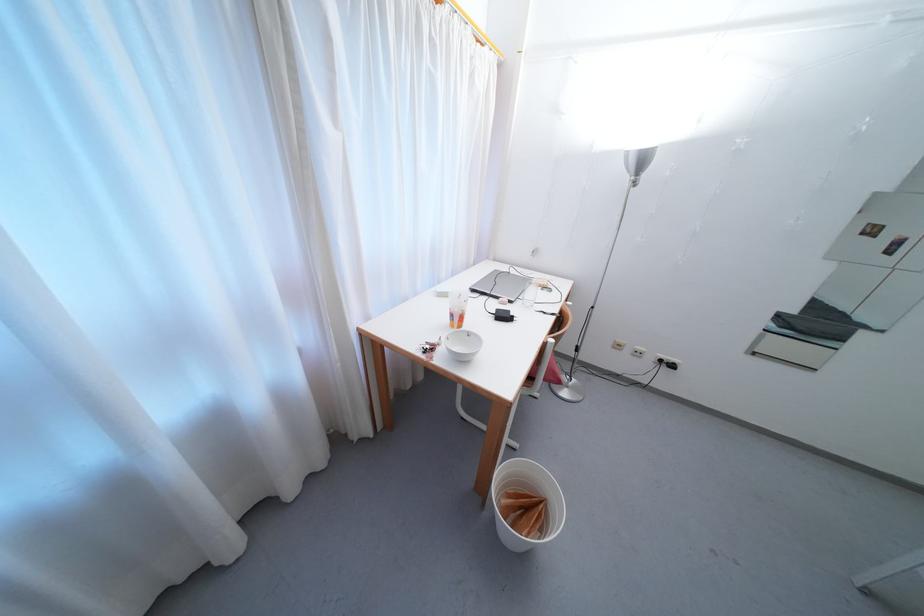
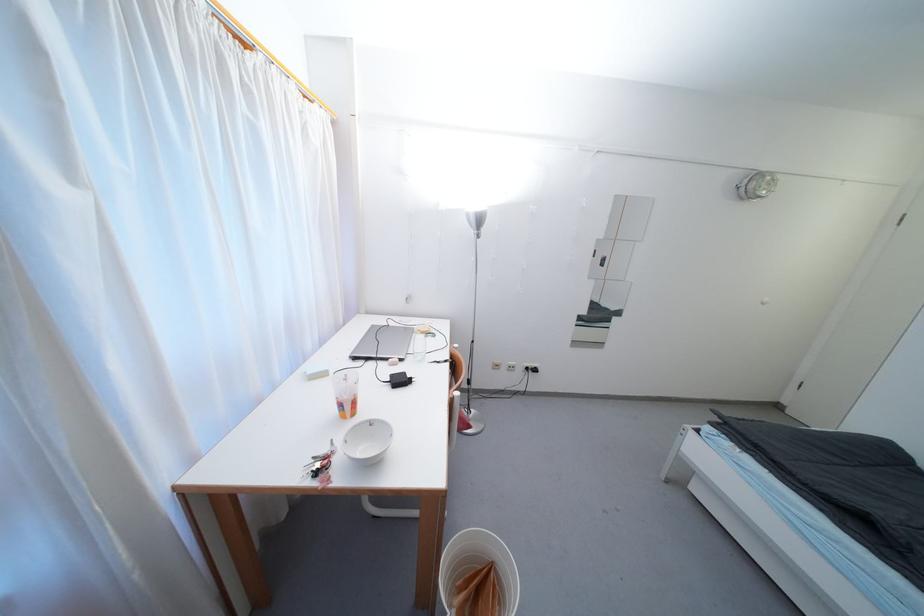
Find the pixel in the second image that matches point (551, 508) in the first image.

(499, 572)